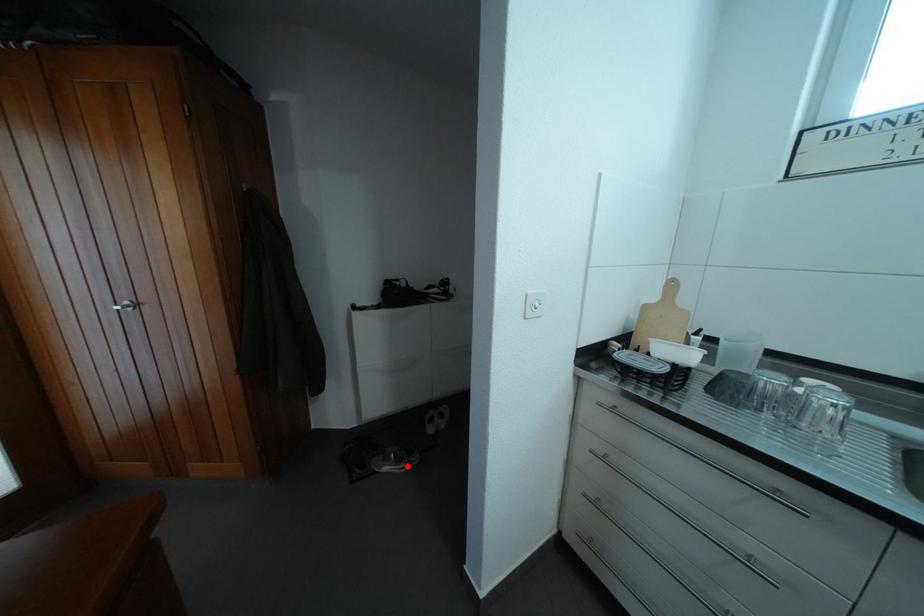
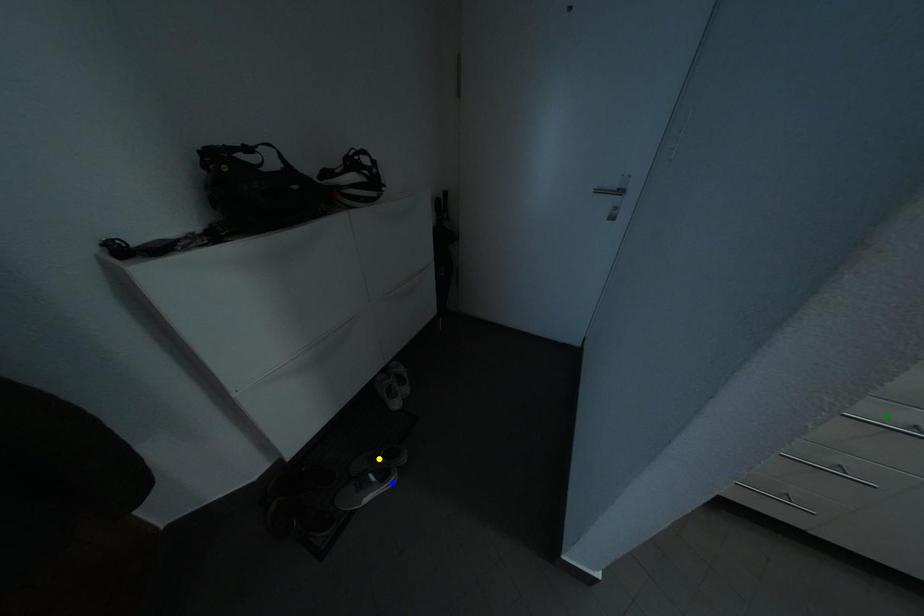
Question: I am providing you with two images of the same scene from different viewpoints. A red point is marked on the first image. You are given multiple points on the second image. In image 2, which mark is for the same physical point as the one in image 1?

Choices:
 (A) green point
 (B) blue point
 (C) yellow point

Answer: (B)